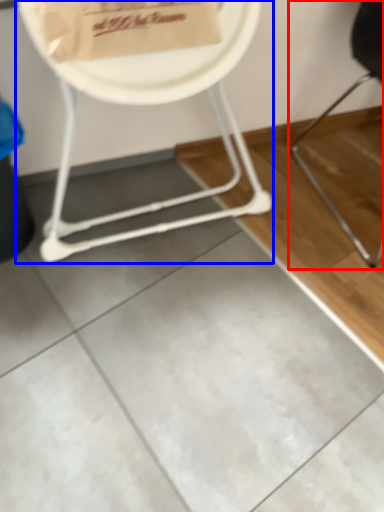
Question: Which point is further to the camera, chair (highlighted by a red box) or chair (highlighted by a blue box)?

Choices:
 (A) chair
 (B) chair

Answer: (A)